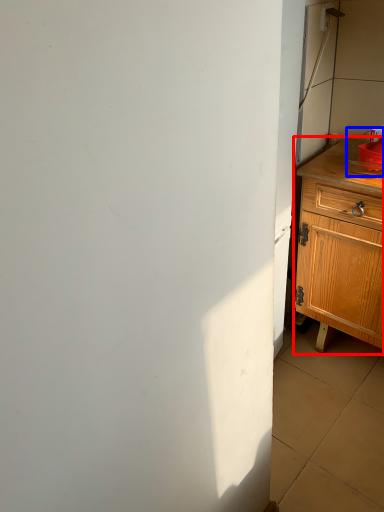
Question: Which object is further to the camera taking this photo, chest of drawers (highlighted by a red box) or sink (highlighted by a blue box)?

Choices:
 (A) chest of drawers
 (B) sink

Answer: (B)